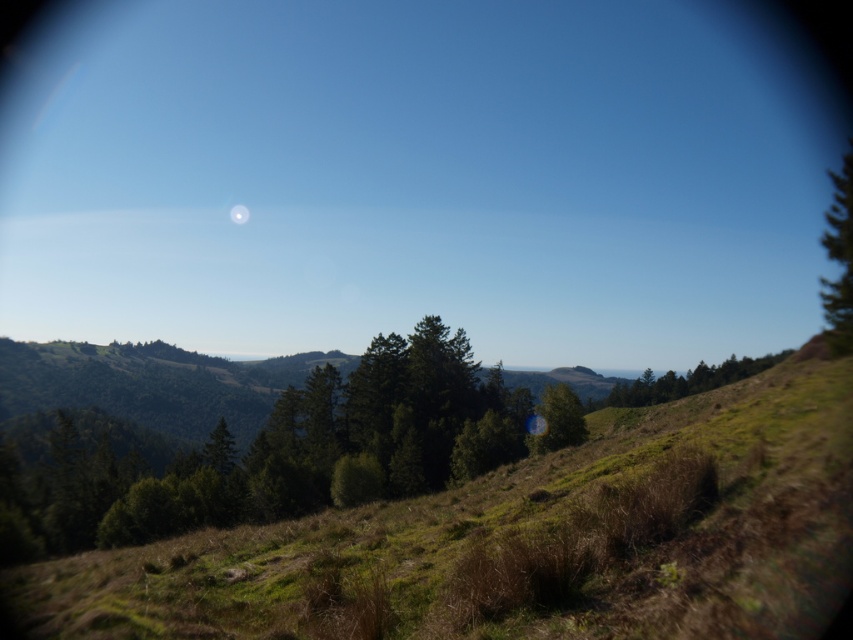
You are standing at the point labeled as point (839, 260) in the image. Looking around, what is the dominant color of the object directly beneath you?

The point (839, 260) indicates a green textured tree at center, so the dominant color beneath you is green.

You are standing in the middle of the landscape and see two trees labeled as green textured tree at center and green matte tree at center. Which tree is positioned to the right when facing the scene?

The green textured tree at center is positioned to the right of the green matte tree at center.

You are standing at the viewpoint of the image and see two points marked in the landscape. The first point is at coordinates point [97,616] and the second is at point [230,211]. Which point is closer to you?

Point [97,616] is in front of point [230,211], so it is closer to you.